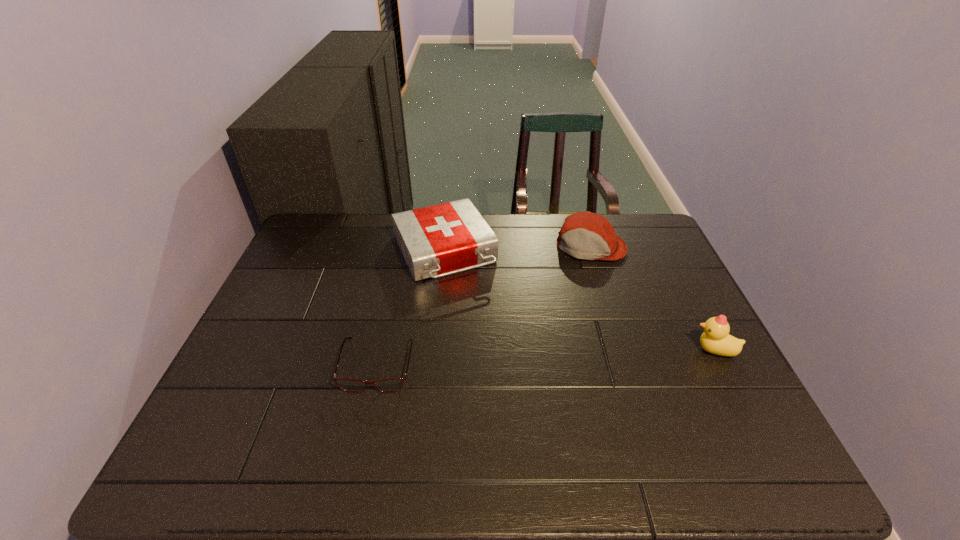
The height and width of the screenshot is (540, 960). Find the location of `free spot between the first-aid kit and the third object from left to right`. free spot between the first-aid kit and the third object from left to right is located at coordinates (517, 249).

This screenshot has height=540, width=960. Find the location of `free space between the rightmost object and the shortest object`. free space between the rightmost object and the shortest object is located at coordinates (546, 357).

Locate an element on the screen. free space that is in between the third object from left to right and the shortest object is located at coordinates (484, 306).

Select which object appears as the closest to the first-aid kit. Please provide its 2D coordinates. Your answer should be formatted as a tuple, i.e. [(x, y)], where the tuple contains the x and y coordinates of a point satisfying the conditions above.

[(394, 384)]

Identify which object is located as the second nearest to the first-aid kit. Please provide its 2D coordinates. Your answer should be formatted as a tuple, i.e. [(x, y)], where the tuple contains the x and y coordinates of a point satisfying the conditions above.

[(584, 235)]

In order to click on blank area in the image that satisfies the following two spatial constraints: 1. on the back side of the first-aid kit; 2. on the left side of the cap in this screenshot , I will do `click(444, 246)`.